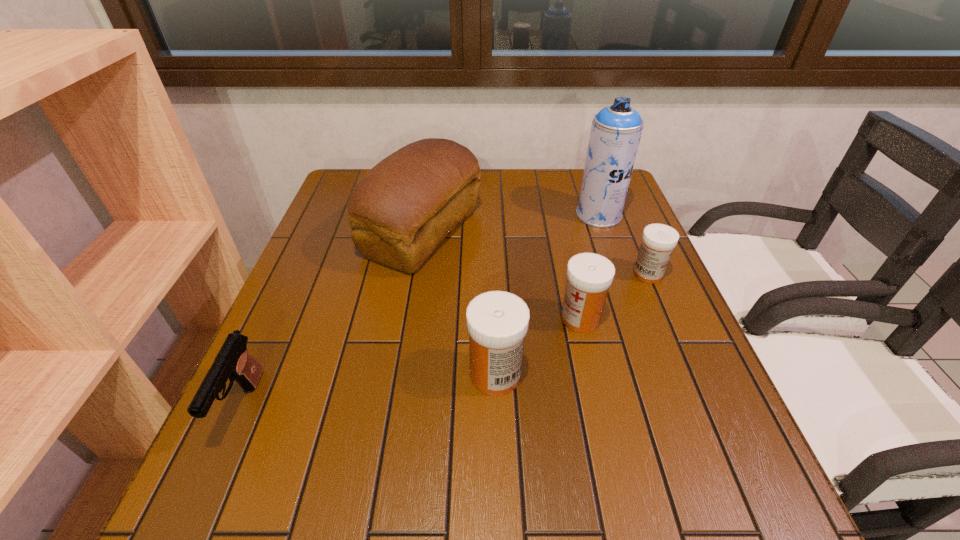
Locate an element on the screen. This screenshot has height=540, width=960. vacant space that is in between the second farthest medicine and the leftmost object is located at coordinates (411, 363).

You are a GUI agent. You are given a task and a screenshot of the screen. Output one action in this format:
    pyautogui.click(x=<x>, y=<y>)
    Task: Click on the unoccupied area between the leftmost medicine and the second medicine from right to left
    
    Given the screenshot: What is the action you would take?
    pyautogui.click(x=538, y=346)

Where is `unoccupied position between the farthest medicine and the second shortest medicine`? unoccupied position between the farthest medicine and the second shortest medicine is located at coordinates (614, 296).

Locate an element on the screen. free space between the leftmost object and the bread is located at coordinates (332, 320).

Locate an element on the screen. The width and height of the screenshot is (960, 540). vacant area between the fifth shortest object and the pistol is located at coordinates (332, 320).

This screenshot has width=960, height=540. I want to click on free point between the bread and the aerosol can, so click(x=511, y=224).

Find the location of a particular element. vacant space that is in between the second medicine from left to right and the shortest medicine is located at coordinates (614, 296).

Locate which object is the second closest to the second tallest object. Please provide its 2D coordinates. Your answer should be formatted as a tuple, i.e. [(x, y)], where the tuple contains the x and y coordinates of a point satisfying the conditions above.

[(497, 322)]

Identify the location of object identified as the fourth closest to the bread. Image resolution: width=960 pixels, height=540 pixels. (233, 361).

The height and width of the screenshot is (540, 960). I want to click on medicine that is the closest to the aerosol can, so click(658, 240).